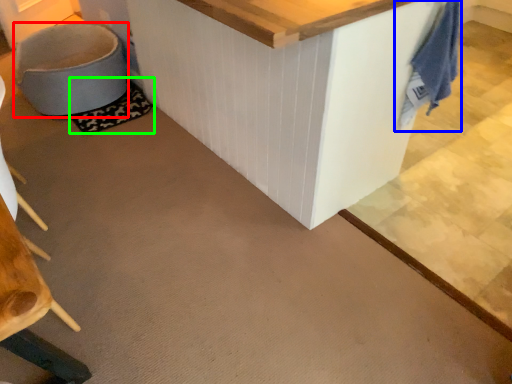
Question: Based on their relative distances, which object is nearer to swivel chair (highlighted by a red box)? Choose from laundry (highlighted by a blue box) and mat (highlighted by a green box).

Choices:
 (A) laundry
 (B) mat

Answer: (B)